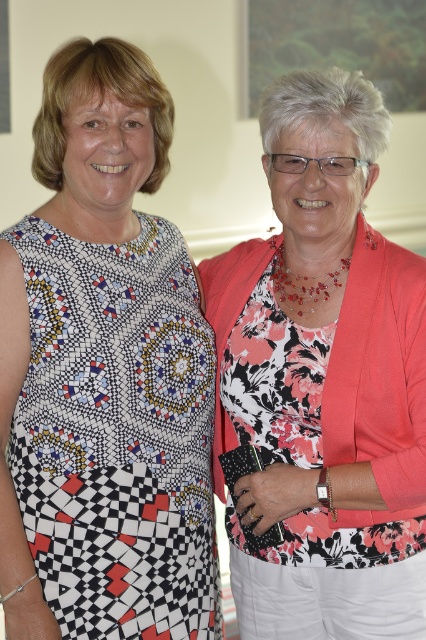
Does printed fabric dress at center have a smaller size compared to floral fabric dress at right?

Indeed, printed fabric dress at center has a smaller size compared to floral fabric dress at right.

Is point (172, 369) closer to camera compared to point (351, 273)?

Yes, point (172, 369) is closer to viewer.

Which is behind, point (85, 497) or point (245, 372)?

Positioned behind is point (245, 372).

Where is `printed fabric dress at center`? printed fabric dress at center is located at coordinates (104, 376).